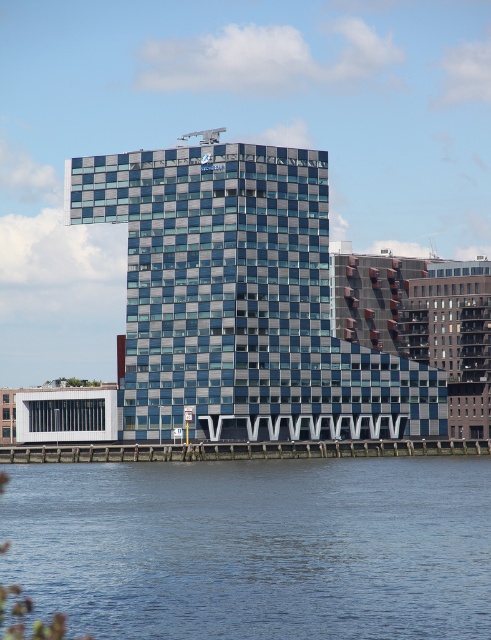
You are standing at the entrance of the modern architectural structure and want to reach the blue water at lower center. According to the coordinates provided, in which direction should you move relative to the building?

The blue water at lower center is located at point 0.856 on the x and 0.519 on the y axis. Since the coordinates are relative to the image, moving towards the lower center direction from the entrance would lead you to the blue water at lower center.

You are standing on the waterfront looking at the blue glass building at center. There is also blue water at lower center in the scene. Which object is closer to you?

The blue water at lower center is closer to the viewer than the blue glass building at center.

You are standing on the waterfront and see the blue water at lower center and the blue glass building at center. Which object is positioned to the right side from your perspective?

The blue water at lower center is positioned to the right of the blue glass building at center, so the blue water at lower center is on the right side.